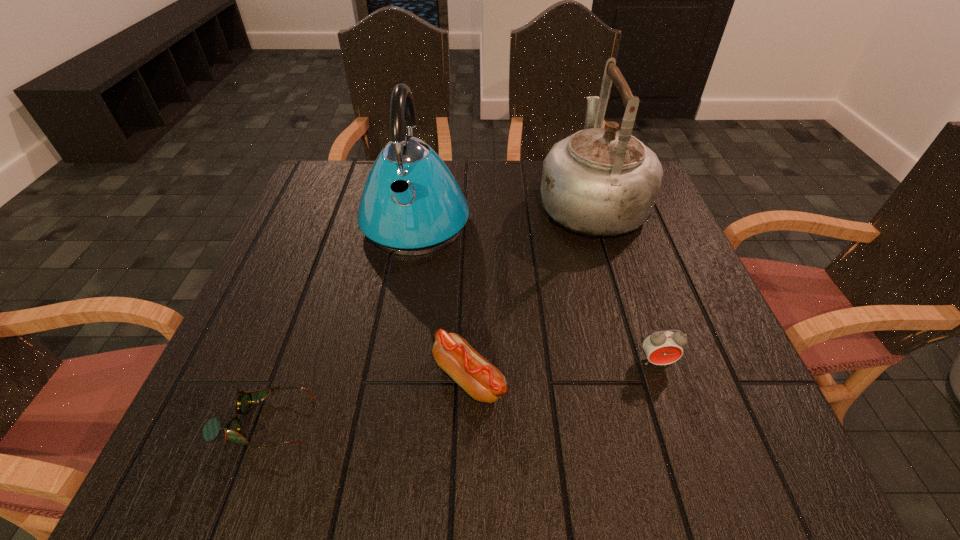
Select which object is the closest to the spectacles. Please provide its 2D coordinates. Your answer should be formatted as a tuple, i.e. [(x, y)], where the tuple contains the x and y coordinates of a point satisfying the conditions above.

[(473, 373)]

The height and width of the screenshot is (540, 960). I want to click on object that stands as the second closest to the fourth tallest object, so click(411, 204).

Where is `blank area in the image that satisfies the following two spatial constraints: 1. at the spout of the sausage; 2. on the right side of the left kettle`? blank area in the image that satisfies the following two spatial constraints: 1. at the spout of the sausage; 2. on the right side of the left kettle is located at coordinates (390, 378).

What are the coordinates of `vacant space that satisfies the following two spatial constraints: 1. at the spout of the left kettle; 2. on the front-facing side of the shortest object` in the screenshot? It's located at (383, 422).